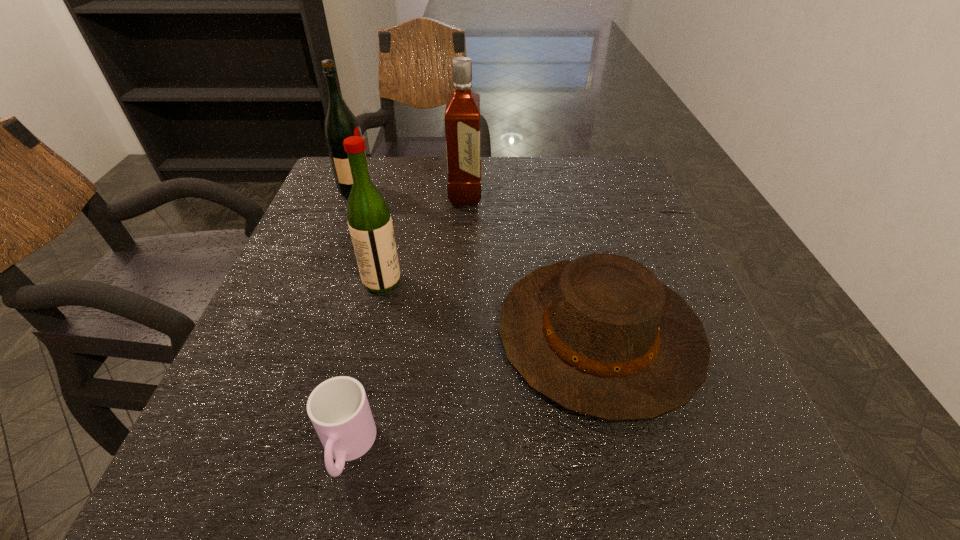
Identify the location of free space at the far right corner. (612, 165).

The width and height of the screenshot is (960, 540). I want to click on blank region between the rightmost object and the second liquor from left to right, so click(x=491, y=308).

You are a GUI agent. You are given a task and a screenshot of the screen. Output one action in this format:
    pyautogui.click(x=<x>, y=<y>)
    Task: Click on the vacant area that lies between the cup and the nearest liquor
    
    Given the screenshot: What is the action you would take?
    pyautogui.click(x=365, y=365)

Find the location of a particular element. vacant area that lies between the nearest liquor and the cup is located at coordinates (365, 365).

At what (x,y) coordinates should I click in order to perform the action: click on vacant space that is in between the rightmost liquor and the leftmost object. Please return your answer as a coordinate pair (x, y). The image size is (960, 540). Looking at the image, I should click on (410, 193).

This screenshot has width=960, height=540. I want to click on vacant region between the second shortest object and the nearest liquor, so click(491, 308).

Find the location of a particular element. vacant space that's between the fourth object from left to right and the nearest liquor is located at coordinates (423, 238).

Where is `free area in between the rightmost liquor and the cup`? Image resolution: width=960 pixels, height=540 pixels. free area in between the rightmost liquor and the cup is located at coordinates (406, 321).

Where is `empty location between the cowboy hat and the cup`? This screenshot has width=960, height=540. empty location between the cowboy hat and the cup is located at coordinates (473, 392).

The height and width of the screenshot is (540, 960). Identify the location of vacant space in between the nearest liquor and the cowboy hat. (491, 308).